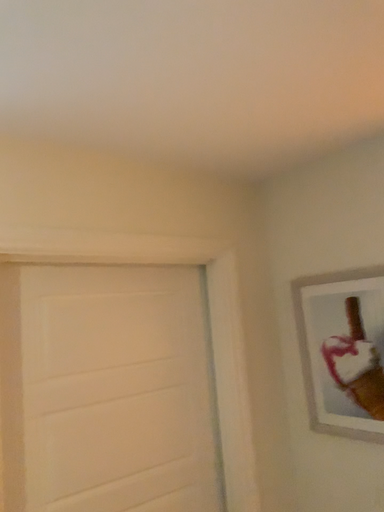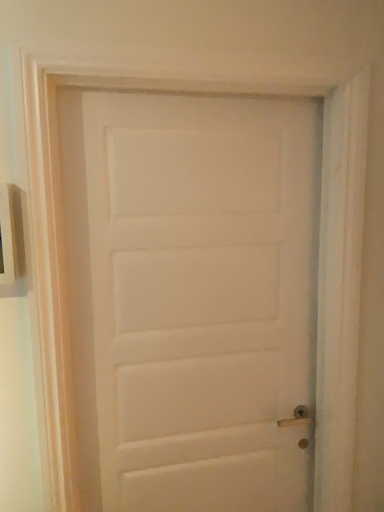
Question: Which way did the camera rotate in the video?

Choices:
 (A) rotated downward
 (B) rotated upward

Answer: (A)